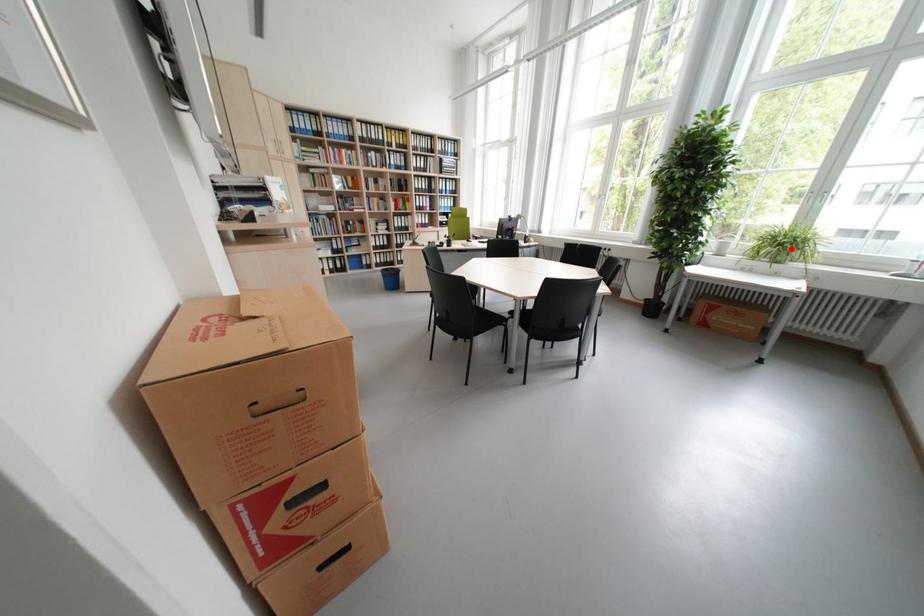
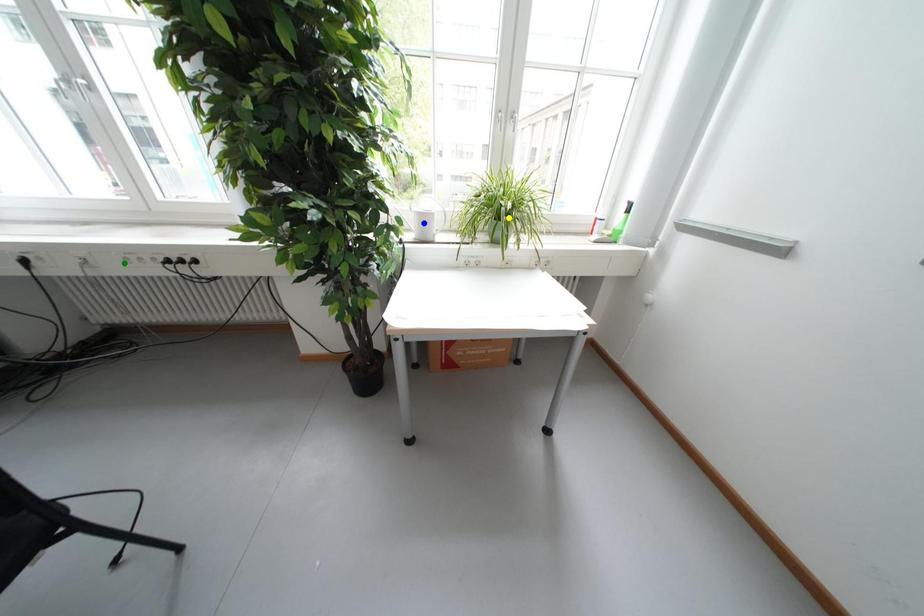
Question: I am providing you with two images of the same scene from different viewpoints. A red point is marked on the first image. You are given multiple points on the second image. Which mark in image 2 goes with the point in image 1?

Choices:
 (A) yellow point
 (B) green point
 (C) blue point

Answer: (A)